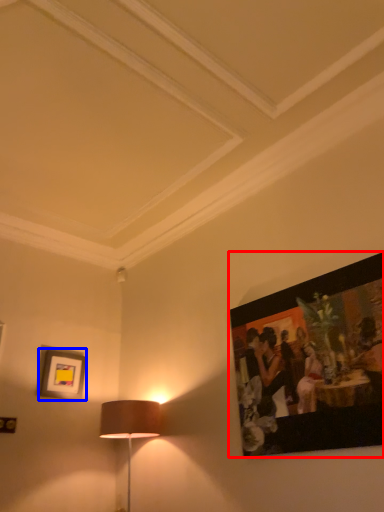
Question: Which of the following is the farthest to the observer, picture frame (highlighted by a red box) or picture frame (highlighted by a blue box)?

Choices:
 (A) picture frame
 (B) picture frame

Answer: (B)